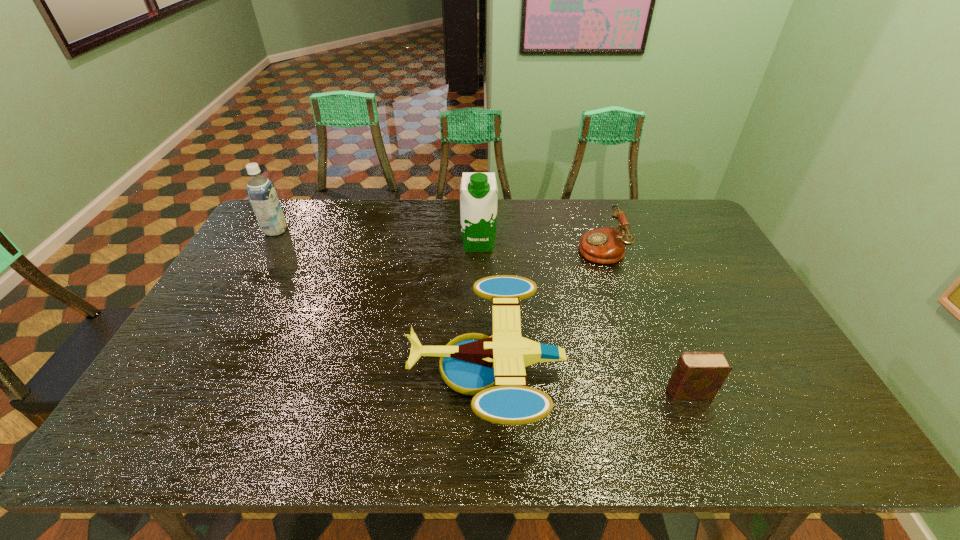
This screenshot has width=960, height=540. I want to click on free location located 0.130m on the spine side of the diary, so click(x=612, y=393).

Locate an element on the screen. The width and height of the screenshot is (960, 540). free region located 0.080m on the spine side of the diary is located at coordinates (633, 393).

Where is `free space located 0.280m on the spine side of the diary`? free space located 0.280m on the spine side of the diary is located at coordinates (550, 393).

Identify the location of free space located 0.260m at the cockpit of the drone. The image size is (960, 540). (307, 368).

Where is `vacant position located at the cockpit of the drone`? The image size is (960, 540). vacant position located at the cockpit of the drone is located at coordinates (264, 368).

This screenshot has height=540, width=960. I want to click on free spot located 0.270m at the cockpit of the drone, so click(303, 368).

Find the location of a particular element. telephone that is at the far edge is located at coordinates (607, 245).

This screenshot has height=540, width=960. I want to click on object at the near edge, so click(x=492, y=368).

Find the location of a particular element. Image resolution: width=960 pixels, height=540 pixels. object that is at the left edge is located at coordinates (261, 192).

This screenshot has width=960, height=540. Find the location of `object that is at the far left corner`. object that is at the far left corner is located at coordinates (261, 192).